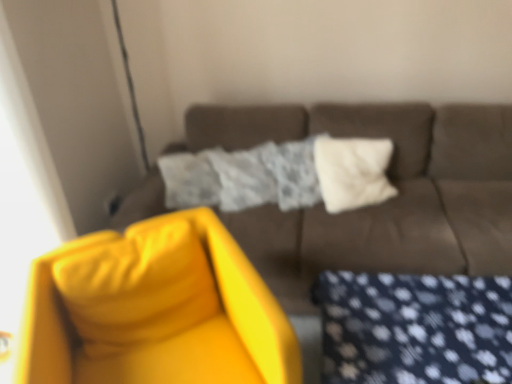
Question: Is matte yellow swivel chair at left not near matte brown couch at center?

Choices:
 (A) yes
 (B) no

Answer: (B)

Question: From the image's perspective, does matte yellow swivel chair at left appear lower than matte brown couch at center?

Choices:
 (A) yes
 (B) no

Answer: (A)

Question: Can you confirm if matte yellow swivel chair at left is thinner than matte brown couch at center?

Choices:
 (A) yes
 (B) no

Answer: (A)

Question: Is matte yellow swivel chair at left further to the viewer compared to matte brown couch at center?

Choices:
 (A) no
 (B) yes

Answer: (A)

Question: Does matte yellow swivel chair at left have a greater width compared to matte brown couch at center?

Choices:
 (A) no
 (B) yes

Answer: (A)

Question: Visually, is matte brown couch at center positioned to the left or to the right of white soft pillow at center?

Choices:
 (A) right
 (B) left

Answer: (B)

Question: From their relative heights in the image, would you say matte brown couch at center is taller or shorter than white soft pillow at center?

Choices:
 (A) tall
 (B) short

Answer: (A)

Question: In terms of size, does matte brown couch at center appear bigger or smaller than white soft pillow at center?

Choices:
 (A) small
 (B) big

Answer: (B)

Question: In the image, is matte brown couch at center positioned in front of or behind white soft pillow at center?

Choices:
 (A) behind
 (B) front

Answer: (B)

Question: From a real-world perspective, is matte brown couch at center above or below matte yellow swivel chair at left?

Choices:
 (A) below
 (B) above

Answer: (B)

Question: Relative to matte yellow swivel chair at left, is matte brown couch at center in front or behind?

Choices:
 (A) front
 (B) behind

Answer: (B)

Question: From the image's perspective, is matte brown couch at center located above or below matte yellow swivel chair at left?

Choices:
 (A) above
 (B) below

Answer: (A)

Question: In terms of height, does matte brown couch at center look taller or shorter compared to matte yellow swivel chair at left?

Choices:
 (A) short
 (B) tall

Answer: (B)

Question: Considering their positions, is matte yellow swivel chair at left located in front of or behind matte brown couch at center?

Choices:
 (A) front
 (B) behind

Answer: (A)

Question: Is point tap(256, 379) closer or farther from the camera than point tap(185, 112)?

Choices:
 (A) farther
 (B) closer

Answer: (B)